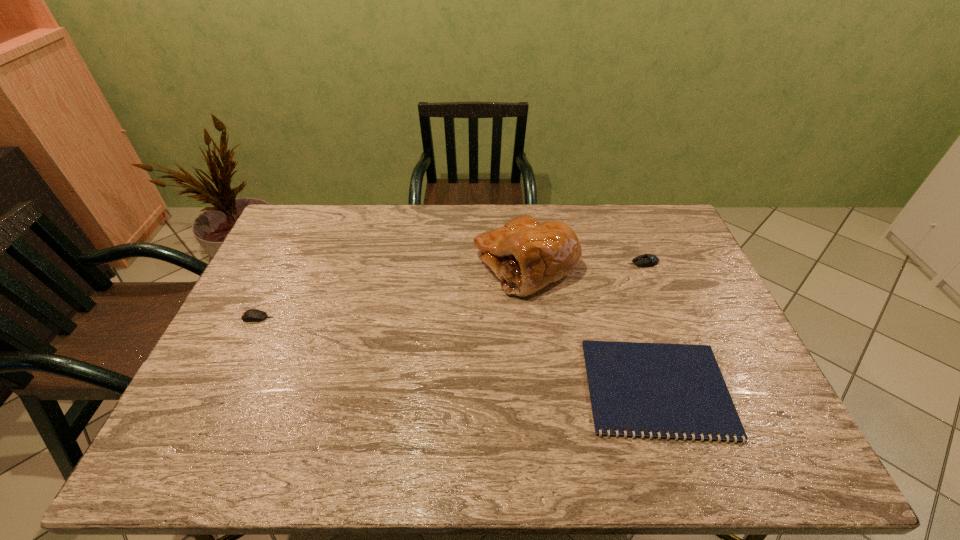
The image size is (960, 540). What are the coordinates of `bread` in the screenshot? It's located at (526, 255).

This screenshot has height=540, width=960. Find the location of `the farther computer mouse`. the farther computer mouse is located at coordinates (646, 260).

Find the location of a particular element. The image size is (960, 540). the nearer computer mouse is located at coordinates (252, 315).

Where is `the shorter computer mouse`? The width and height of the screenshot is (960, 540). the shorter computer mouse is located at coordinates (252, 315).

At what (x,y) coordinates should I click in order to perform the action: click on the nearest object. Please return your answer as a coordinate pair (x, y). The width and height of the screenshot is (960, 540). Looking at the image, I should click on (675, 388).

Locate an element on the screen. Image resolution: width=960 pixels, height=540 pixels. the shortest object is located at coordinates (675, 388).

Where is `free space located on the filling side of the tallest object`? Image resolution: width=960 pixels, height=540 pixels. free space located on the filling side of the tallest object is located at coordinates (428, 265).

At what (x,y) coordinates should I click in order to perform the action: click on free space located on the filling side of the tallest object. Please return your answer as a coordinate pair (x, y). Looking at the image, I should click on (420, 265).

The height and width of the screenshot is (540, 960). I want to click on vacant region located on the filling side of the tallest object, so click(x=362, y=265).

At what (x,y) coordinates should I click in order to perform the action: click on vacant space located 0.370m on the left of the farther computer mouse. Please return your answer as a coordinate pair (x, y). The image size is (960, 540). Looking at the image, I should click on (516, 263).